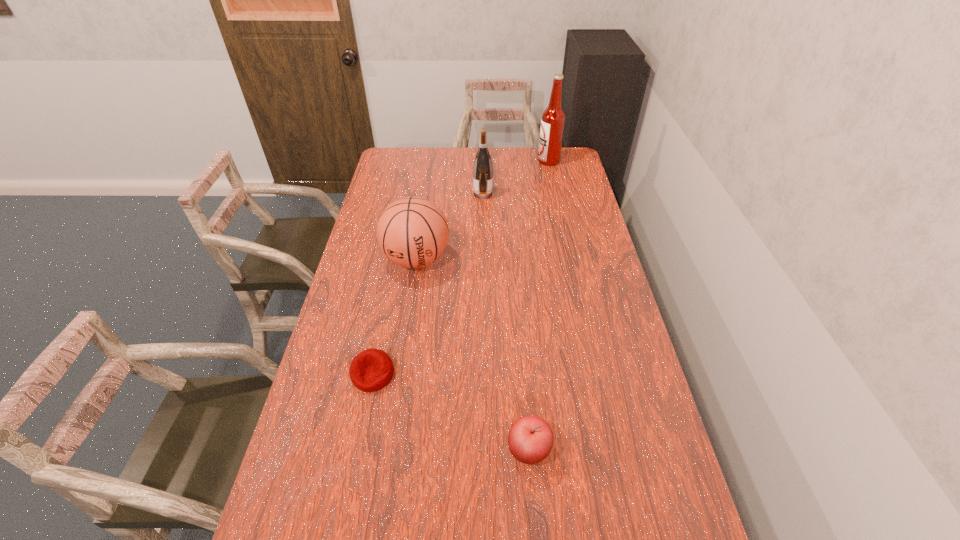
The height and width of the screenshot is (540, 960). Identify the location of alcohol. (553, 118).

You are a GUI agent. You are given a task and a screenshot of the screen. Output one action in this format:
    pyautogui.click(x=<x>, y=<y>)
    Task: Click on the tallest object
    This screenshot has width=960, height=540.
    Given the screenshot: What is the action you would take?
    pyautogui.click(x=553, y=118)

Identify the location of the third object from right to left. (483, 168).

The image size is (960, 540). What are the coordinates of `the second tallest object` in the screenshot? It's located at (483, 168).

Find the location of `the third farthest object`. the third farthest object is located at coordinates (412, 232).

I want to click on the third tallest object, so click(412, 232).

The width and height of the screenshot is (960, 540). In order to click on the second shortest object in this screenshot , I will do `click(530, 440)`.

Where is `apple`? apple is located at coordinates (530, 440).

You are a GUI agent. You are given a task and a screenshot of the screen. Output one action in this format:
    pyautogui.click(x=<x>, y=<y>)
    Task: Click on the beanbag
    The width and height of the screenshot is (960, 540).
    Given the screenshot: What is the action you would take?
    tap(371, 370)

I want to click on the shortest object, so click(371, 370).